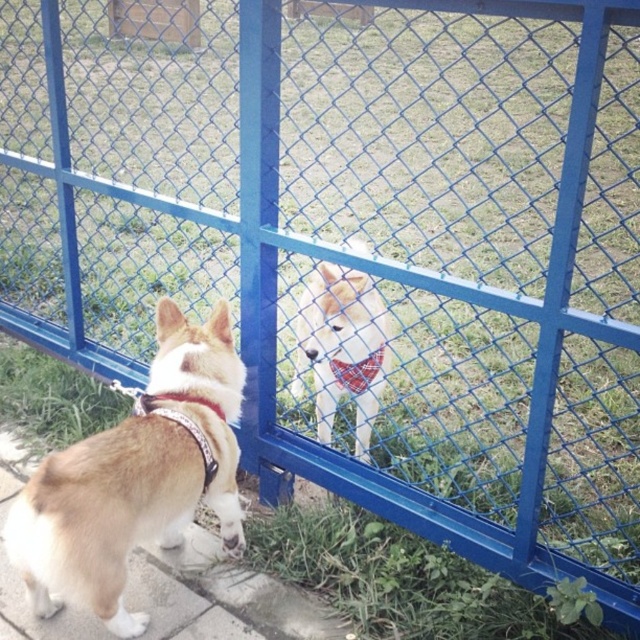
Is brown fur dog at left thinner than plaid fabric neckband at center?

In fact, brown fur dog at left might be wider than plaid fabric neckband at center.

Which of these two, brown fur dog at left or plaid fabric neckband at center, stands shorter?

With less height is plaid fabric neckband at center.

The width and height of the screenshot is (640, 640). What do you see at coordinates (134, 477) in the screenshot?
I see `brown fur dog at left` at bounding box center [134, 477].

Where is `brown fur dog at left`? brown fur dog at left is located at coordinates (134, 477).

Who is more distant from viewer, (317, 320) or (358, 394)?

The point (358, 394) is more distant.

Where is `white fur dog at center`? white fur dog at center is located at coordinates (340, 348).

Between brown fur dog at left and white fur dog at center, which one is positioned lower?

brown fur dog at left is lower down.

Does brown fur dog at left appear over white fur dog at center?

Actually, brown fur dog at left is below white fur dog at center.

Image resolution: width=640 pixels, height=640 pixels. I want to click on brown fur dog at left, so click(134, 477).